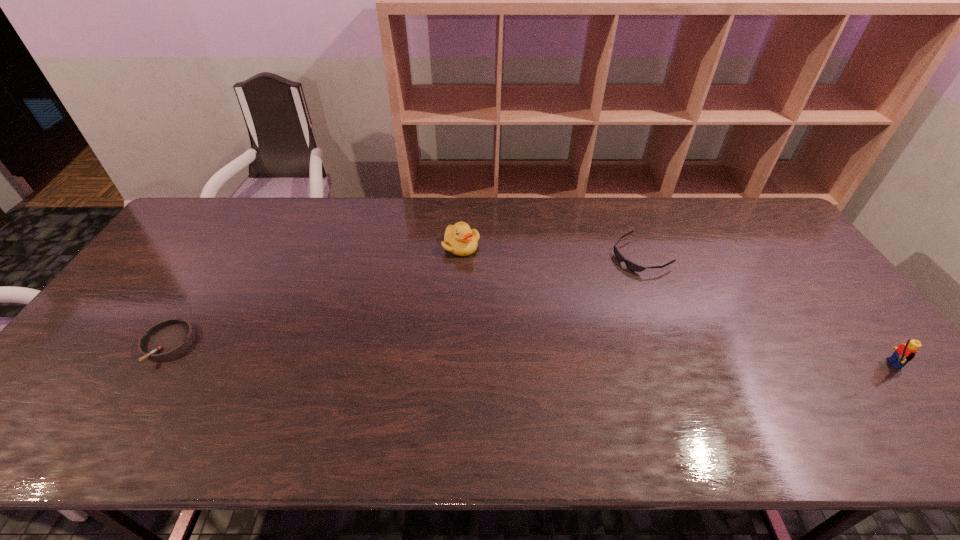
In order to click on vacant space located on the front-facing side of the Lego in this screenshot , I will do `click(714, 364)`.

Image resolution: width=960 pixels, height=540 pixels. I want to click on free space located on the front-facing side of the Lego, so coord(827,364).

Identify the location of vacant region located 0.190m on the front-facing side of the duckling. This screenshot has height=540, width=960. (465, 302).

I want to click on free space located 0.330m on the front-facing side of the duckling, so click(x=467, y=342).

Identify the location of free location located 0.290m on the front-facing side of the duckling. (466, 330).

Find the location of `vacant space located 0.310m on the front-facing side of the sunglasses`. vacant space located 0.310m on the front-facing side of the sunglasses is located at coordinates (542, 307).

Where is `vacant space located on the front-facing side of the sunglasses`? Image resolution: width=960 pixels, height=540 pixels. vacant space located on the front-facing side of the sunglasses is located at coordinates pos(531,313).

Where is `vacant space located 0.220m on the front-facing side of the sunglasses`? vacant space located 0.220m on the front-facing side of the sunglasses is located at coordinates (567, 294).

Find the location of a particular element. The width and height of the screenshot is (960, 540). duckling situated at the far edge is located at coordinates (459, 239).

Identify the location of sunglasses present at the far edge. This screenshot has height=540, width=960. (630, 265).